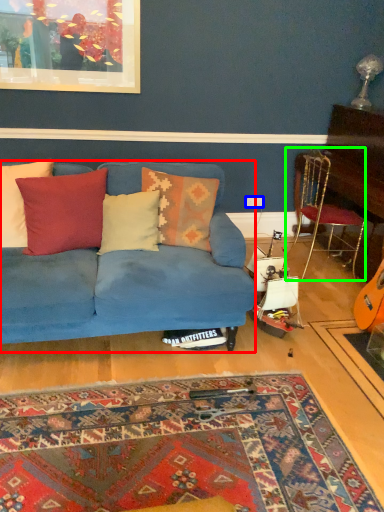
Question: Which is farther away from studio couch (highlighted by a red box)? power outlet (highlighted by a blue box) or chair (highlighted by a green box)?

Choices:
 (A) power outlet
 (B) chair

Answer: (A)